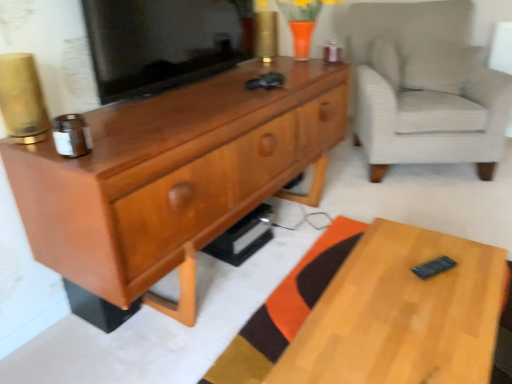
Identify the location of free point in front of light gray textured armchair at right. This screenshot has height=384, width=512. (430, 202).